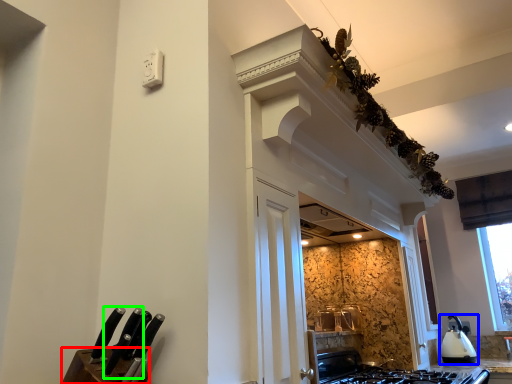
Question: Which is nearer to the cabinetry (highlighted by a red box)? kitchen appliance (highlighted by a blue box) or knife (highlighted by a green box).

Choices:
 (A) kitchen appliance
 (B) knife

Answer: (B)